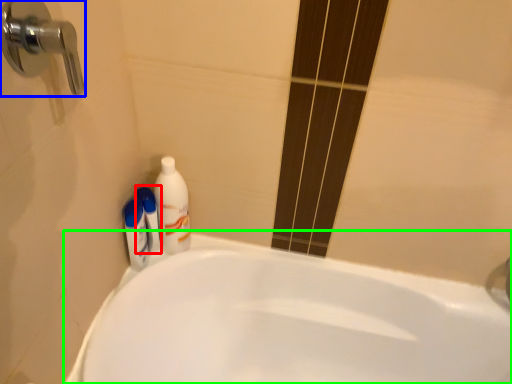
Question: Which object is positioned closest to mouthwash (highlighted by a red box)? Select from door handle (highlighted by a blue box) and bathtub (highlighted by a green box).

Choices:
 (A) door handle
 (B) bathtub

Answer: (B)